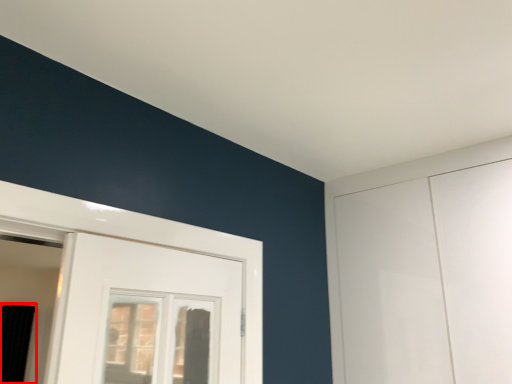
Question: From the image's perspective, where is curtain (annotated by the red box) located in relation to window in the image?

Choices:
 (A) below
 (B) above

Answer: (A)